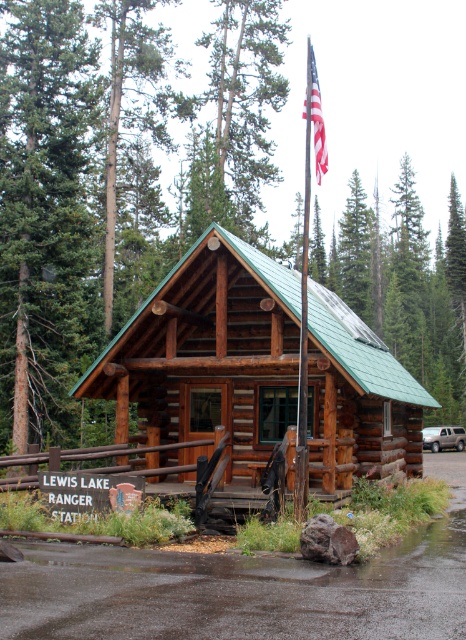
Question: Can you confirm if american flag at upper center is smaller than satin silver suv at right?

Choices:
 (A) yes
 (B) no

Answer: (B)

Question: Which of the following is the farthest from the observer?

Choices:
 (A) (320, 120)
 (B) (164, 428)
 (C) (299, 404)

Answer: (B)

Question: Can you confirm if matte wood cabin at center is smaller than green wood tree at upper center?

Choices:
 (A) no
 (B) yes

Answer: (B)

Question: Which object is positioned closest to the green wood tree at upper center?

Choices:
 (A) matte wood cabin at center
 (B) metallic flag pole at upper center
 (C) green coniferous tree at left
 (D) satin silver suv at right

Answer: (B)

Question: Which point is farther from the camera taking this photo?

Choices:
 (A) (307, 349)
 (B) (459, 435)
 (C) (302, 115)

Answer: (C)

Question: Is american flag at upper center to the right of satin silver suv at right from the viewer's perspective?

Choices:
 (A) yes
 (B) no

Answer: (B)